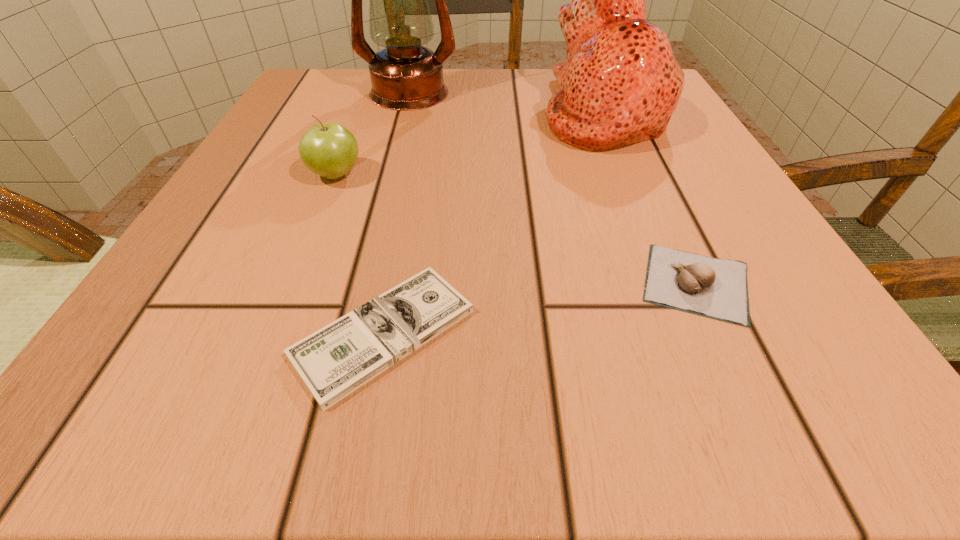
Find the location of a particular element. Image resolution: width=960 pixels, height=540 pixels. object located in the far left corner section of the desktop is located at coordinates (405, 76).

Where is `object positioned at the far right corner`? The image size is (960, 540). object positioned at the far right corner is located at coordinates (620, 84).

I want to click on free point at the far edge, so click(x=405, y=119).

Locate an element on the screen. vacant space at the left edge is located at coordinates (285, 204).

Where is `free location at the right edge`? free location at the right edge is located at coordinates (704, 206).

Find the location of a particular element. The height and width of the screenshot is (540, 960). vacant area at the far left corner of the desktop is located at coordinates pos(346,99).

Image resolution: width=960 pixels, height=540 pixels. In the image, there is a desktop. In order to click on free space at the near left corner in this screenshot , I will do `click(118, 388)`.

The height and width of the screenshot is (540, 960). In the image, there is a desktop. Identify the location of vacant space at the near right corner. (710, 390).

At what (x,y) coordinates should I click in order to perform the action: click on free spot between the shortest object and the oil lamp. Please return your answer as a coordinate pair (x, y). This screenshot has width=960, height=540. Looking at the image, I should click on (396, 213).

Locate an element on the screen. free point between the oil lamp and the garlic is located at coordinates (552, 188).